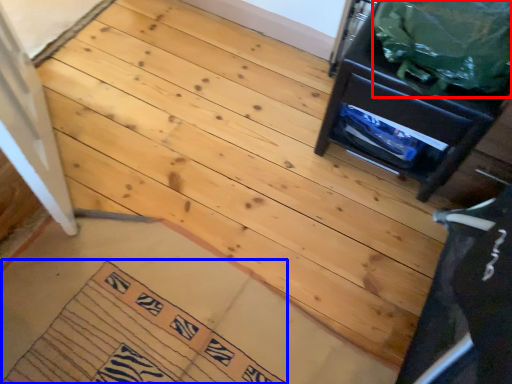
Question: Which object appears farthest to the camera in this image, garbage (highlighted by a red box) or doormat (highlighted by a blue box)?

Choices:
 (A) garbage
 (B) doormat

Answer: (B)